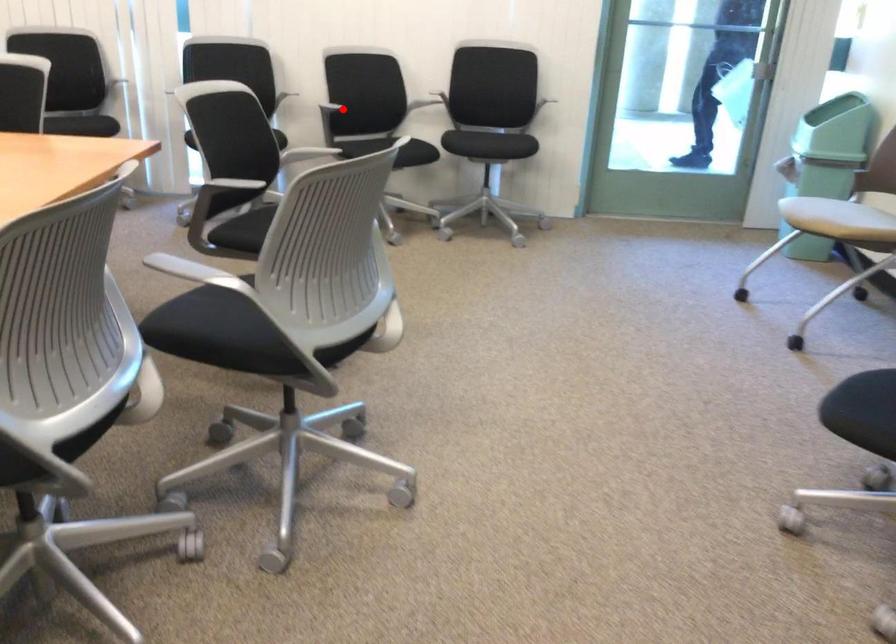
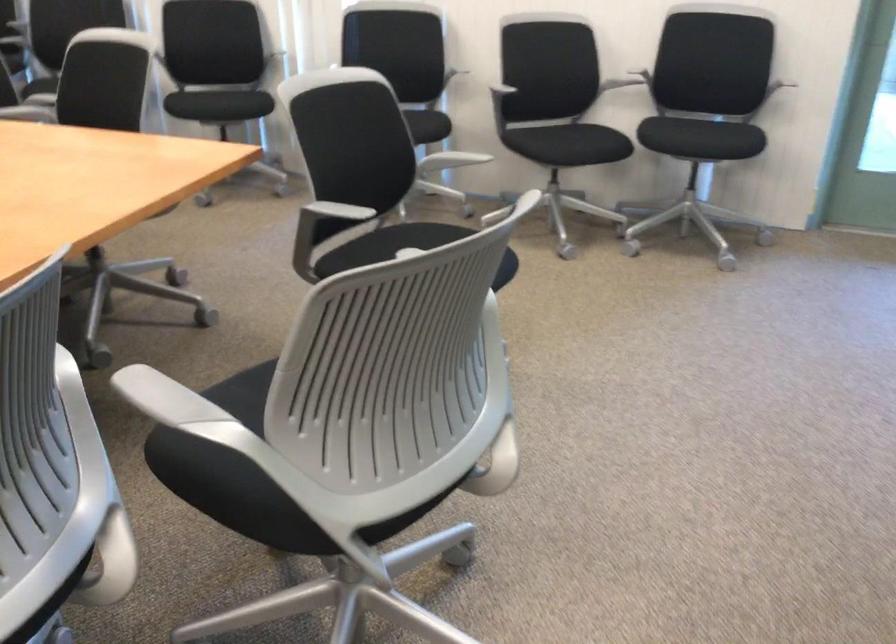
Find the pixel in the second image that matches the highlighted location in the first image.

(510, 96)